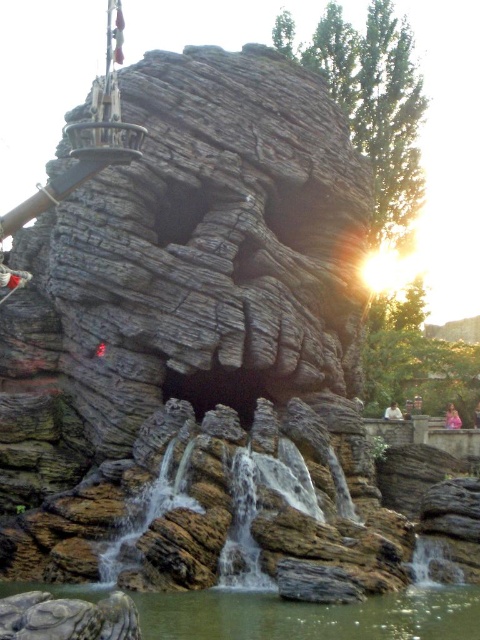
In the scene shown: Between pink fabric person at lower right and light brown hair at center, which one appears on the right side from the viewer's perspective?

pink fabric person at lower right is more to the right.

Who is more distant from viewer, (450, 413) or (399, 419)?

The point (450, 413) is behind.

Where is `pink fabric person at lower right`? This screenshot has height=640, width=480. pink fabric person at lower right is located at coordinates pyautogui.click(x=452, y=417).

Does greenish water at lower center have a smaller size compared to light brown hair at center?

Incorrect, greenish water at lower center is not smaller in size than light brown hair at center.

Who is higher up, greenish water at lower center or light brown hair at center?

light brown hair at center is above.

Between point (194, 620) and point (384, 417), which one is positioned in front?

Point (194, 620)

The width and height of the screenshot is (480, 640). In order to click on greenish water at lower center in this screenshot , I will do `click(311, 616)`.

This screenshot has width=480, height=640. In order to click on greenish water at lower center in this screenshot , I will do `click(311, 616)`.

Is greenish water at lower center above pink fabric person at lower right?

No, greenish water at lower center is not above pink fabric person at lower right.

I want to click on greenish water at lower center, so click(311, 616).